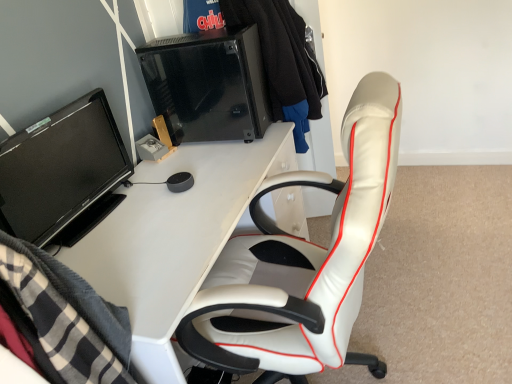
Identify the location of free point to the left of black glass desktop computer at upper center. (177, 156).